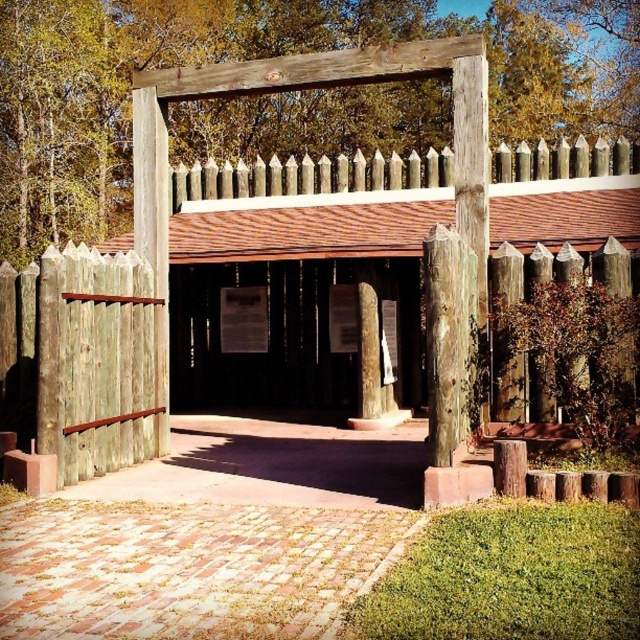
Consider the image. Between wooden signpost at center and weathered wood gate at center, which one has less height?

wooden signpost at center is shorter.

In order to click on wooden signpost at center in this screenshot , I will do `click(298, 337)`.

Locate an element on the screen. The width and height of the screenshot is (640, 640). wooden signpost at center is located at coordinates (298, 337).